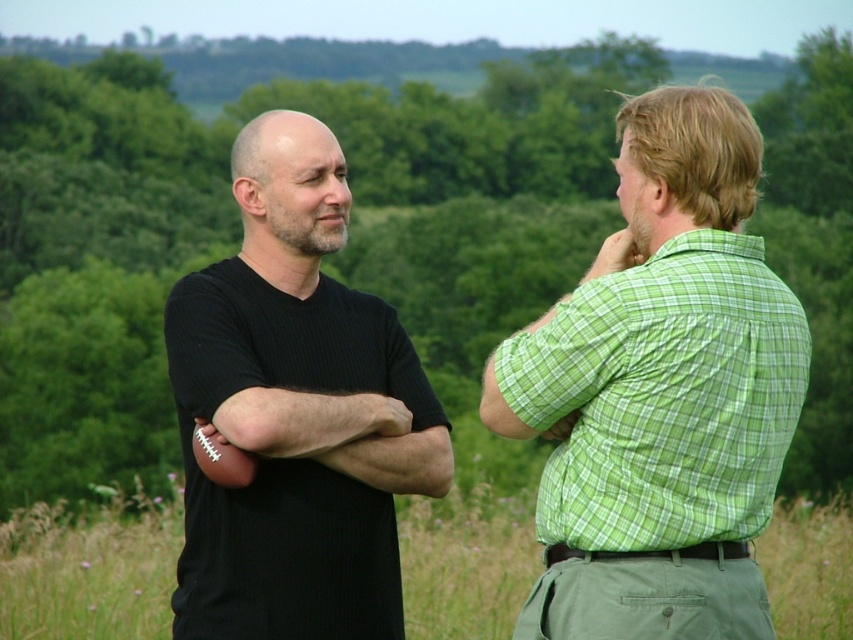
You are a photographer standing in front of the scene. You want to take a photo of the black matte football at left and the green grass at center. Which object will appear larger in your photo?

The black matte football at left is closer to the viewer than the green grass at center, so it will appear larger in the photo.

You are a photographer trying to capture a photo of the green plaid shirt at right and the black matte football at left. Based on their positions, which object is higher in the image?

The green plaid shirt at right is above the black matte football at left, so the green plaid shirt at right is higher in the image.